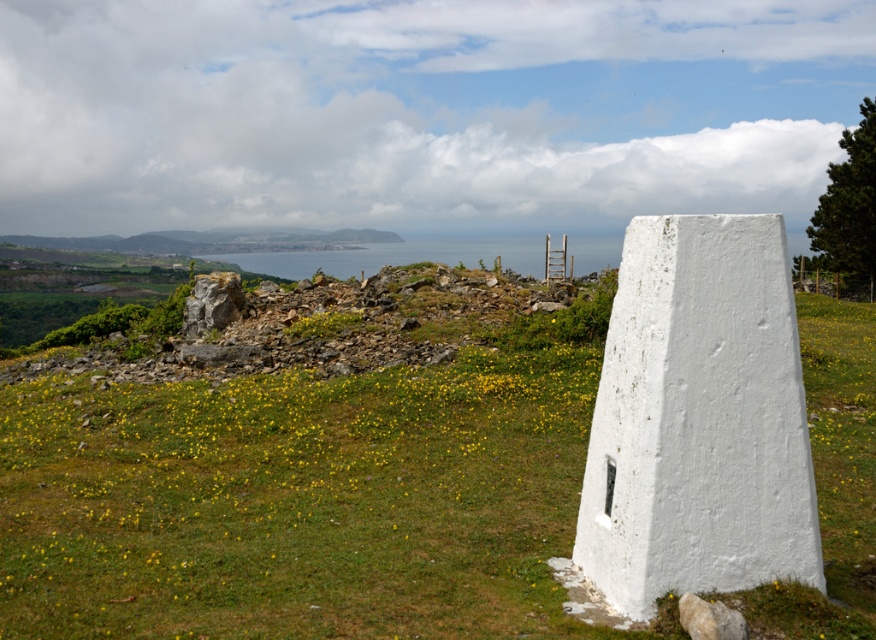
You are a hiker navigating through this landscape and want to reach the trig point on the right. You see two points marked on the map as point 1 at coordinates (258, 536) and point 2 at coordinates (606, 250). Which point should you head towards first to get closer to the trig point?

You should head towards point 1 at coordinates (258, 536) first because it is in front of point 2 at coordinates (606, 250), meaning it is closer to your current position and the trig point.